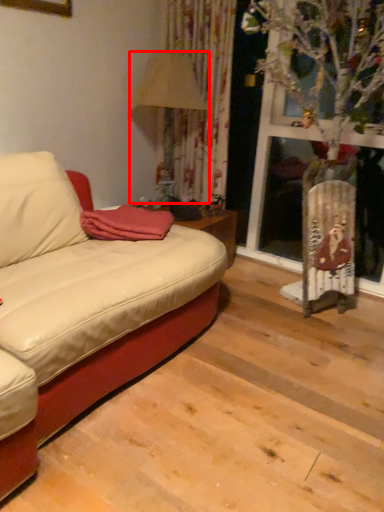
Question: From the image, what is the correct spatial relationship of lamp (annotated by the red box) in relation to blanket?

Choices:
 (A) left
 (B) right

Answer: (B)